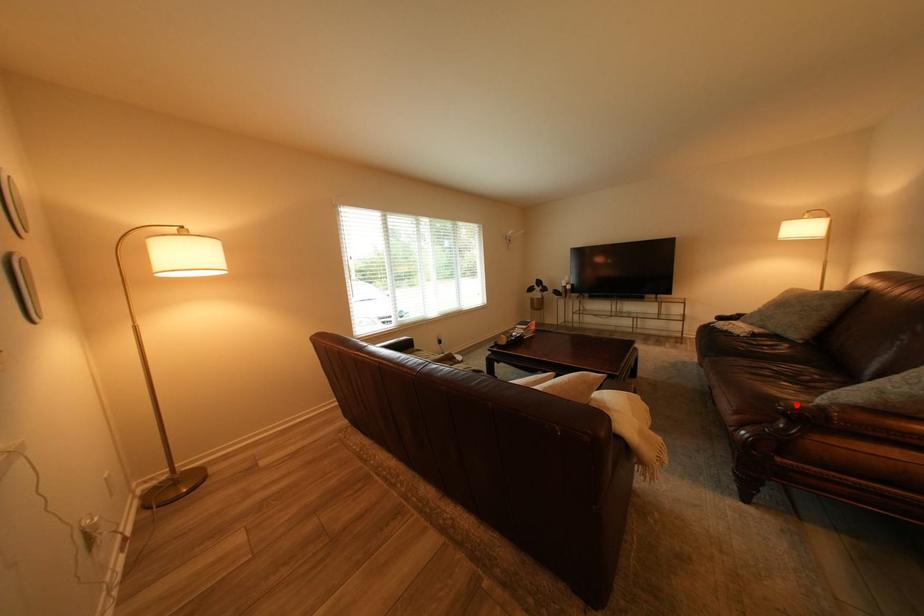
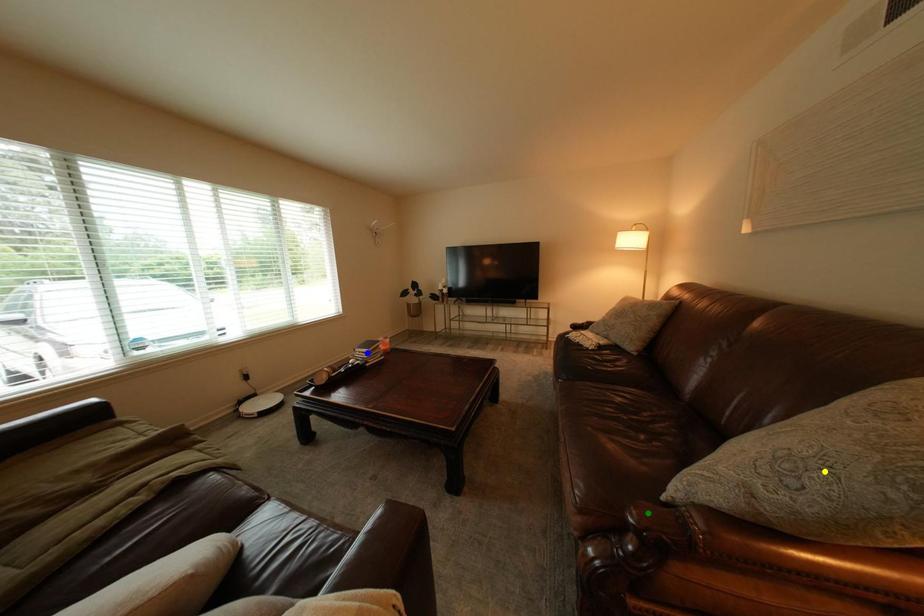
Question: I am providing you with two images of the same scene from different viewpoints. A red point is marked on the first image. You are given multiple points on the second image. Which point in image 2 is actually the same real-world point as the red point in image 1?

Choices:
 (A) blue point
 (B) green point
 (C) yellow point

Answer: (B)